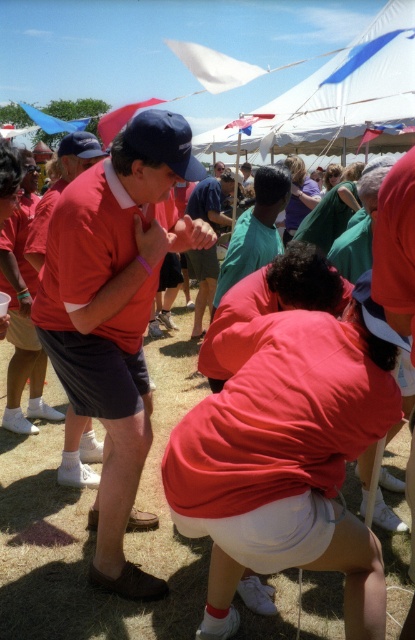
You are standing at the viewpoint of the image and want to reach the two points marked in the scene. Which point, point (320, 394) or point (192, 196), is closer to you?

Point (320, 394) is closer to you than point (192, 196).

From the picture: You are organizing a photo shoot and need to place two models wearing the matte red shirt at center and teal fabric shirt at center side by side. Based on the scene description, which model should stand on the left to ensure their shirts don t overlap?

The matte red shirt at center is wider than the teal fabric shirt at center. To prevent overlapping, the model wearing the matte red shirt at center should be placed on the left so there s more space between them.